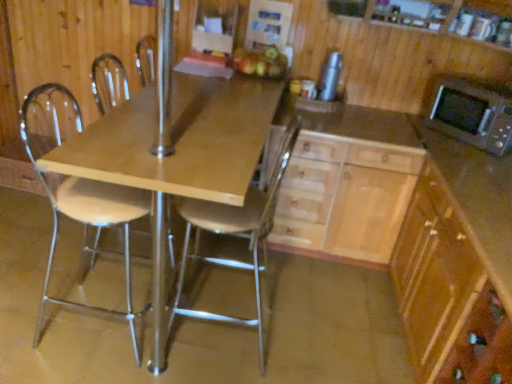
Question: Looking at the image, does silver metallic thermos at upper right seem bigger or smaller compared to metallic silver chair at center, which is counted as the second chair, starting from the left?

Choices:
 (A) big
 (B) small

Answer: (B)

Question: In the image, is silver metallic thermos at upper right on the left side or the right side of metallic silver chair at center, the 1th chair in the right-to-left sequence?

Choices:
 (A) right
 (B) left

Answer: (A)

Question: Estimate the real-world distances between objects in this image. Which object is closer to the light wood/wooden cabinet at center, the first cabinetry viewed from the left?

Choices:
 (A) metallic silver chair at center, which is counted as the second chair, starting from the left
 (B) white plastic chair at left, the second chair viewed from the right
 (C) silver metallic thermos at upper right
 (D) light brown wood cabinet at lower right, acting as the 1th cabinetry starting from the right
 (E) wooden cabinet at center

Answer: (E)

Question: Which object is positioned closest to the wooden cabinet at center?

Choices:
 (A) light wood/wooden cabinet at center, the first cabinetry viewed from the left
 (B) white plastic chair at left, arranged as the first chair when viewed from the left
 (C) metallic silver chair at center, which is counted as the second chair, starting from the left
 (D) silver metallic microwave oven at upper right
 (E) silver metallic thermos at upper right

Answer: (A)